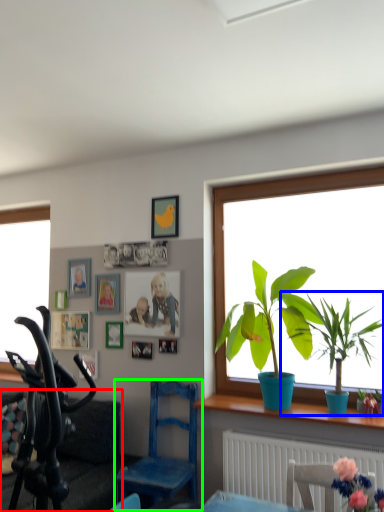
Question: Which object is positioned farthest from couch (highlighted by a red box)? Select from houseplant (highlighted by a blue box) and chair (highlighted by a green box).

Choices:
 (A) houseplant
 (B) chair

Answer: (A)